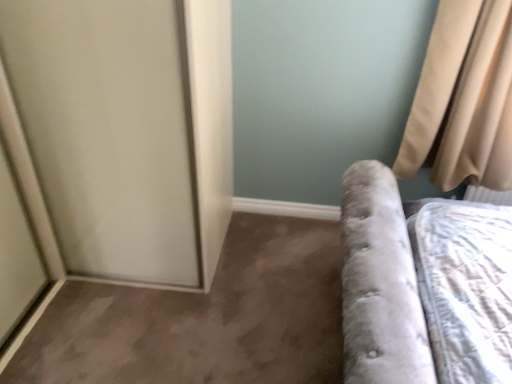
Question: Do you think beige fabric curtain at upper right is within white frosted glass screen door at left, or outside of it?

Choices:
 (A) inside
 (B) outside

Answer: (B)

Question: From a real-world perspective, is beige fabric curtain at upper right above or below white frosted glass screen door at left?

Choices:
 (A) below
 (B) above

Answer: (B)

Question: Considering the positions of beige fabric curtain at upper right and white frosted glass screen door at left in the image, is beige fabric curtain at upper right taller or shorter than white frosted glass screen door at left?

Choices:
 (A) short
 (B) tall

Answer: (A)

Question: From the image's perspective, relative to beige fabric curtain at upper right, is white frosted glass screen door at left above or below?

Choices:
 (A) above
 (B) below

Answer: (B)

Question: Looking at the image, does white frosted glass screen door at left seem bigger or smaller compared to beige fabric curtain at upper right?

Choices:
 (A) small
 (B) big

Answer: (B)

Question: Is white frosted glass screen door at left taller or shorter than beige fabric curtain at upper right?

Choices:
 (A) tall
 (B) short

Answer: (A)

Question: Does point (60, 84) appear closer or farther from the camera than point (501, 51)?

Choices:
 (A) closer
 (B) farther

Answer: (A)